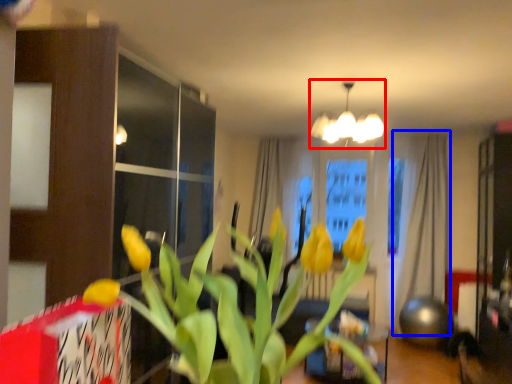
Question: Which point is further to the camera, lamp (highlighted by a red box) or curtain (highlighted by a blue box)?

Choices:
 (A) lamp
 (B) curtain

Answer: (B)